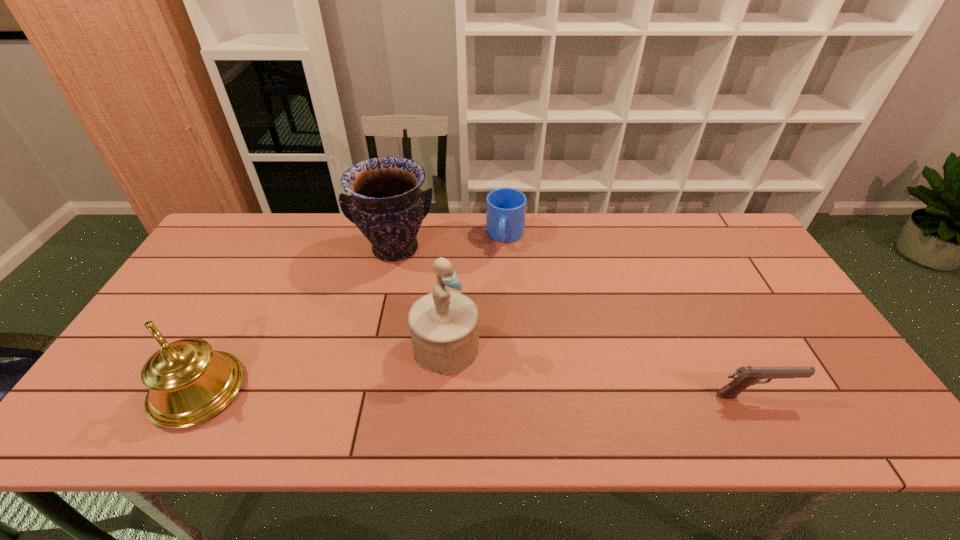
Locate an element on the screen. The image size is (960, 540). object located at the left edge is located at coordinates (189, 383).

This screenshot has width=960, height=540. In order to click on object that is at the right edge in this screenshot , I will do `click(745, 376)`.

I want to click on object present at the near left corner, so click(x=189, y=383).

The image size is (960, 540). In order to click on object located in the near right corner section of the desktop in this screenshot , I will do `click(745, 376)`.

Where is `vacant area at the far edge`? The image size is (960, 540). vacant area at the far edge is located at coordinates (420, 247).

The height and width of the screenshot is (540, 960). I want to click on vacant region at the near edge of the desktop, so click(x=695, y=383).

This screenshot has height=540, width=960. What are the coordinates of `free spot at the right edge of the desktop` in the screenshot? It's located at (802, 362).

You are a GUI agent. You are given a task and a screenshot of the screen. Output one action in this format:
    pyautogui.click(x=<x>, y=<y>)
    Task: Click on the vacant position at the far left corner of the desktop
    
    Given the screenshot: What is the action you would take?
    pyautogui.click(x=236, y=227)

In the image, there is a desktop. At what (x,y) coordinates should I click in order to perform the action: click on vacant space at the near right corner. Please return your answer as a coordinate pair (x, y). Looking at the image, I should click on (810, 387).

The width and height of the screenshot is (960, 540). I want to click on free space between the pistol and the pottery, so click(574, 322).